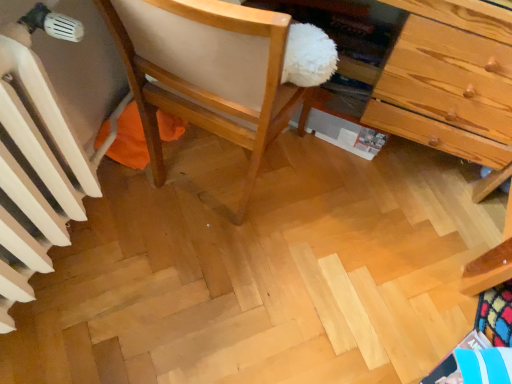
Find the location of `wooden chair at center`. wooden chair at center is located at coordinates (208, 75).

The image size is (512, 384). What do you see at coordinates (208, 75) in the screenshot?
I see `wooden chair at center` at bounding box center [208, 75].

What is the approximate height of white painted radiator at left?

24.05 inches.

In the scene shown: Measure the distance between point (64, 174) and camera.

Point (64, 174) and camera are 3.43 feet apart from each other.

What do you see at coordinates (39, 148) in the screenshot?
I see `white painted radiator at left` at bounding box center [39, 148].

Locate an element on the screen. white painted radiator at left is located at coordinates (39, 148).

Identify the location of wooden chair at center. The height and width of the screenshot is (384, 512). tap(208, 75).

Can you confirm if white painted radiator at left is positioned to the left of wooden chair at center?

Indeed, white painted radiator at left is positioned on the left side of wooden chair at center.

Is white painted radiator at left positioned in front of wooden chair at center?

Yes, white painted radiator at left is in front of wooden chair at center.

Is point (32, 215) in front of point (156, 1)?

No, (32, 215) is behind (156, 1).

From the image's perspective, is white painted radiator at left positioned above or below wooden chair at center?

Based on their image positions, white painted radiator at left is located beneath wooden chair at center.

From a real-world perspective, which is physically above, white painted radiator at left or wooden chair at center?

From a 3D spatial view, wooden chair at center is above.

Between white painted radiator at left and wooden chair at center, which one has smaller width?

Thinner between the two is white painted radiator at left.

Does white painted radiator at left have a lesser height compared to wooden chair at center?

Yes, white painted radiator at left is shorter than wooden chair at center.

Considering the sizes of objects white painted radiator at left and wooden chair at center in the image provided, who is bigger, white painted radiator at left or wooden chair at center?

wooden chair at center.

Can wooden chair at center be found inside white painted radiator at left?

No, wooden chair at center is not surrounded by white painted radiator at left.

Is white painted radiator at left in contact with wooden chair at center?

No, white painted radiator at left is not making contact with wooden chair at center.

Is wooden chair at center at the back of white painted radiator at left?

No, white painted radiator at left is not facing the opposite direction of wooden chair at center.

How different are the orientations of white painted radiator at left and wooden chair at center in degrees?

There is a 89.6-degree angle between the facing directions of white painted radiator at left and wooden chair at center.

Locate an element on the screen. This screenshot has width=512, height=384. radiator that appears below the wooden chair at center (from a real-world perspective) is located at coordinates (39, 148).

Is wooden chair at center to the right of white painted radiator at left from the viewer's perspective?

Yes.

Considering their positions, is wooden chair at center located in front of or behind white painted radiator at left?

Clearly, wooden chair at center is behind white painted radiator at left.

Is point (221, 27) closer or farther from the camera than point (8, 50)?

Point (221, 27) is closer to the camera than point (8, 50).

From the image's perspective, would you say wooden chair at center is shown under white painted radiator at left?

No, from the image's perspective, wooden chair at center is not below white painted radiator at left.

From a real-world perspective, relative to white painted radiator at left, is wooden chair at center vertically above or below?

In terms of real-world spatial position, wooden chair at center is above white painted radiator at left.

Consider the image. Between wooden chair at center and white painted radiator at left, which one has smaller width?

With smaller width is white painted radiator at left.

Considering the sizes of wooden chair at center and white painted radiator at left in the image, is wooden chair at center taller or shorter than white painted radiator at left?

In the image, wooden chair at center appears to be taller than white painted radiator at left.

Based on their sizes in the image, would you say wooden chair at center is bigger or smaller than white painted radiator at left?

In the image, wooden chair at center appears to be larger than white painted radiator at left.

Can white painted radiator at left be found inside wooden chair at center?

No, white painted radiator at left is located outside of wooden chair at center.

Are wooden chair at center and white painted radiator at left beside each other?

wooden chair at center and white painted radiator at left are clearly separated.

Based on the photo, is wooden chair at center positioned with its back to white painted radiator at left?

Correct, wooden chair at center is looking away from white painted radiator at left.

What's the angular difference between wooden chair at center and white painted radiator at left's facing directions?

The angular difference between wooden chair at center and white painted radiator at left is 89.6 degrees.

Measure the distance between wooden chair at center and white painted radiator at left.

The distance of wooden chair at center from white painted radiator at left is 12.61 inches.

At what (x,y) coordinates should I click in order to perform the action: click on chair that appears on the right of white painted radiator at left. Please return your answer as a coordinate pair (x, y). This screenshot has height=384, width=512. Looking at the image, I should click on (208, 75).

You are a GUI agent. You are given a task and a screenshot of the screen. Output one action in this format:
    pyautogui.click(x=<x>, y=<y>)
    Task: Click on the chair that appears above the white painted radiator at left (from the image's perspective)
    The width and height of the screenshot is (512, 384).
    Given the screenshot: What is the action you would take?
    pyautogui.click(x=208, y=75)

Locate an element on the screen. chair positioned vertically above the white painted radiator at left (from a real-world perspective) is located at coordinates (208, 75).